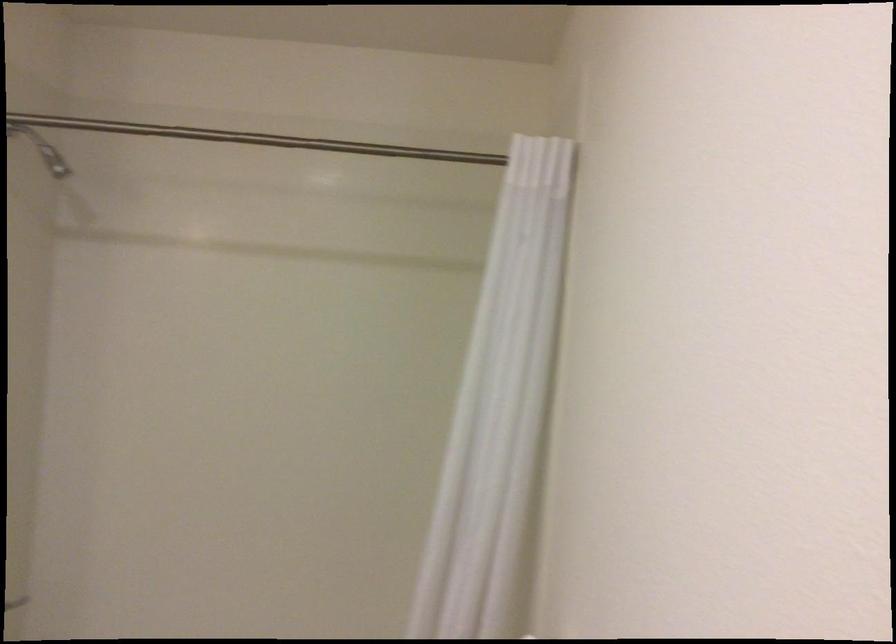
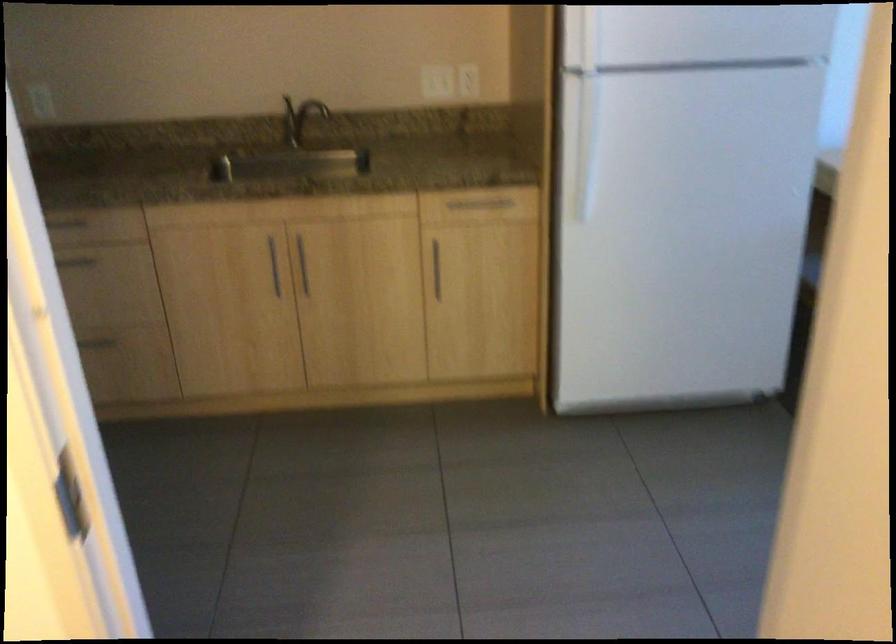
Based on the continuous images, in which direction is the camera rotating?

The rotation direction of the camera is right-down.